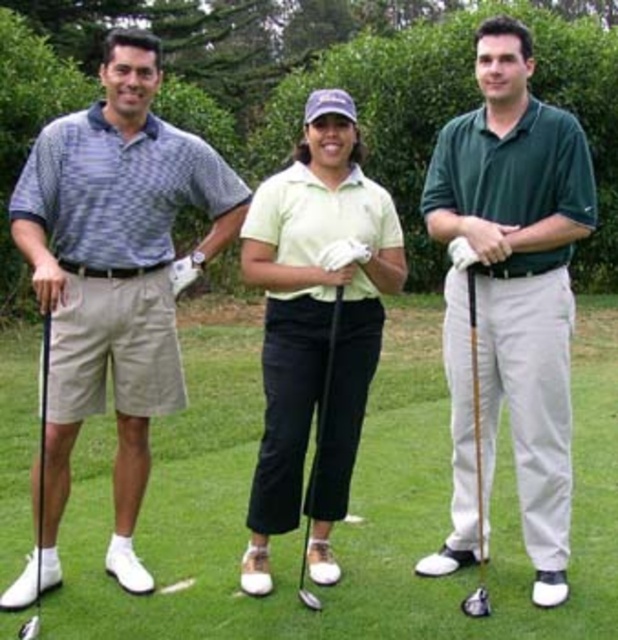
Question: Which object is closer to the camera taking this photo?

Choices:
 (A) matte blue polo shirt at left
 (B) white leather golf club at left

Answer: (B)

Question: Where is green grass at center located in relation to green matte shirt at center in the image?

Choices:
 (A) left
 (B) right

Answer: (A)

Question: Among these points, which one is farthest from the camera?

Choices:
 (A) (174, 252)
 (B) (483, 556)

Answer: (A)

Question: Is the position of matte blue polo shirt at left less distant than that of wooden shaft golf club at center?

Choices:
 (A) no
 (B) yes

Answer: (B)

Question: Which object is the farthest from the wooden shaft golf club at center?

Choices:
 (A) green grass at center
 (B) green matte shirt at center
 (C) matte blue polo shirt at left

Answer: (A)

Question: Can you confirm if matte blue polo shirt at left is positioned to the left of wooden shaft golf club at center?

Choices:
 (A) yes
 (B) no

Answer: (A)